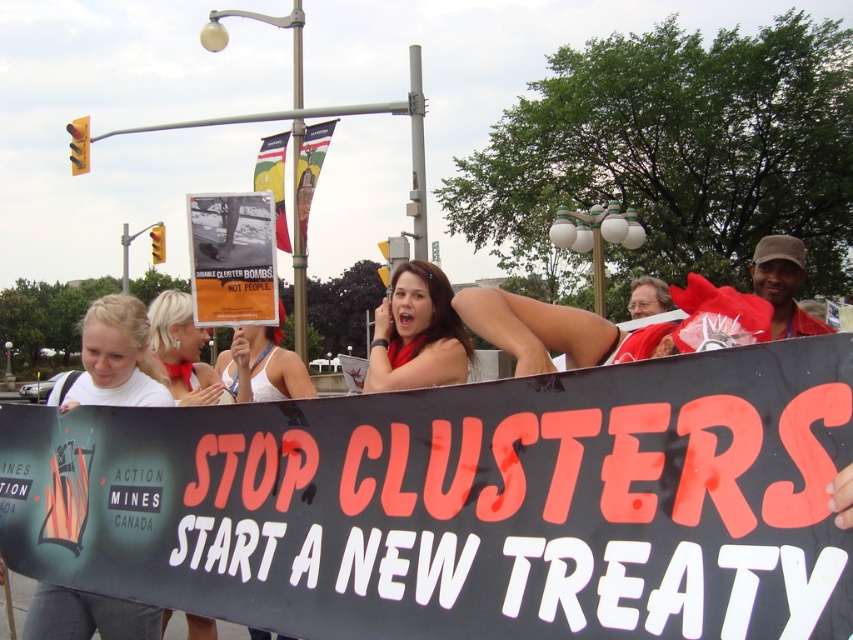
Question: Which of these objects is positioned closest to the paper poster at center?

Choices:
 (A) matte red scarf at center
 (B) blonde hair at center
 (C) white matte t-shirt at center

Answer: (B)

Question: Is black fabric banner at center positioned before matte red scarf at center?

Choices:
 (A) no
 (B) yes

Answer: (B)

Question: Which point is closer to the camera taking this photo?

Choices:
 (A) (427, 538)
 (B) (136, 342)
 (C) (260, 214)
 (D) (453, 378)

Answer: (A)

Question: Is black fabric banner at center above paper poster at center?

Choices:
 (A) yes
 (B) no

Answer: (B)

Question: Observing the image, what is the correct spatial positioning of black fabric banner at center in reference to blonde hair at center?

Choices:
 (A) right
 (B) left

Answer: (A)

Question: Which point is closer to the camera?

Choices:
 (A) (416, 314)
 (B) (194, 202)
 (C) (161, 326)
 (D) (119, 524)

Answer: (D)